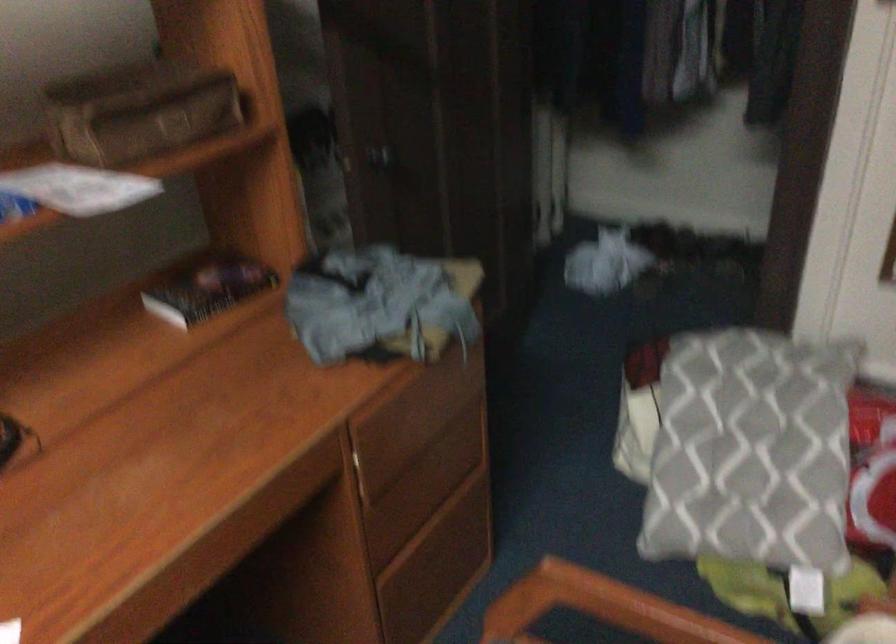
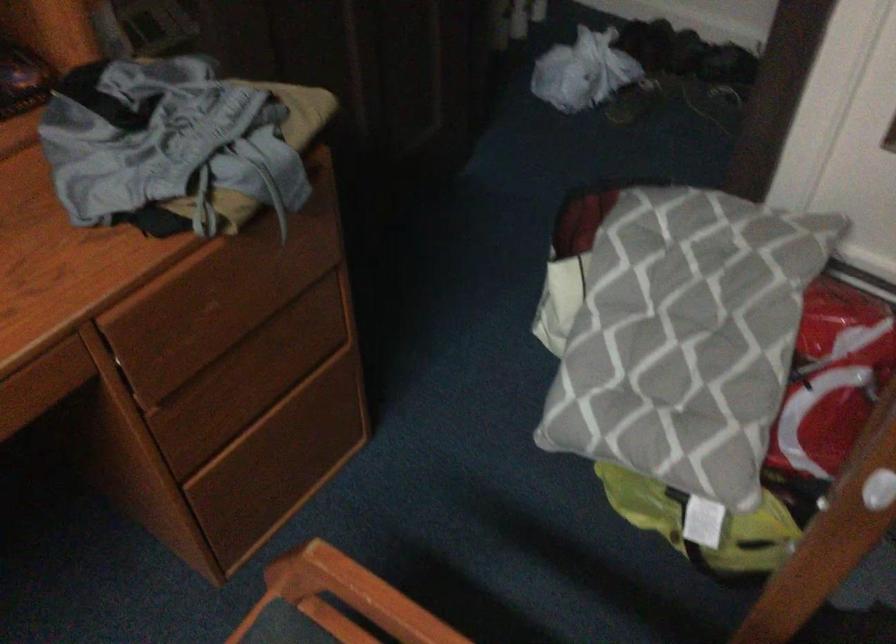
In the second image, find the point that corresponds to point (751, 442) in the first image.

(677, 335)